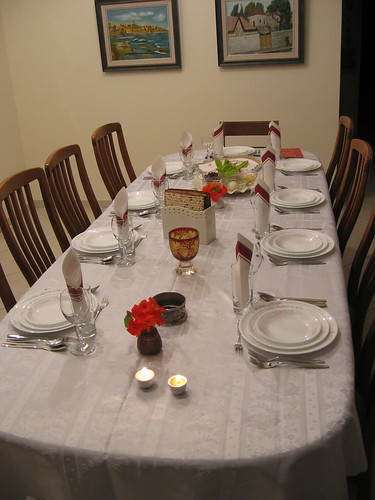
Identify the location of drinking glass. (73, 306), (119, 231), (158, 192), (187, 159), (208, 144), (254, 262).